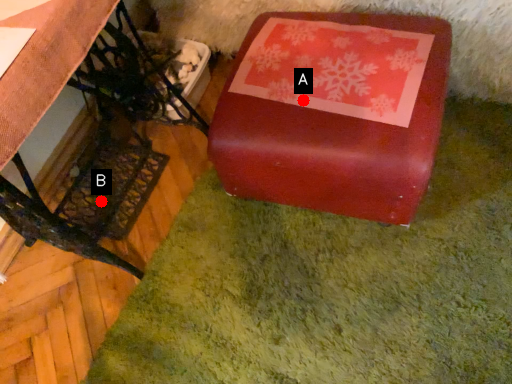
Question: Two points are circled on the image, labeled by A and B beside each circle. Among these points, which one is farthest from the camera?

Choices:
 (A) A is further
 (B) B is further

Answer: (B)